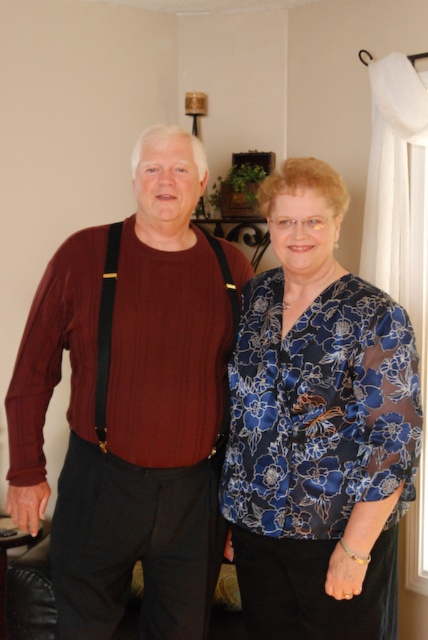
You are a tailor who needs to hang a corduroy sweater at center and a blue satin blouse at center on a rack. The rack has a height limit of 40 cm. Which item might exceed the rack height limit?

The corduroy sweater at center is much taller as blue satin blouse at center, so the corduroy sweater at center might exceed the rack height limit.

You are standing in the living room and want to pick up the corduroy sweater at center. Based on its position, can you tell me which direction you should move to reach it?

The corduroy sweater at center is located at point coordinates, so you should move towards the center of the room to reach it.